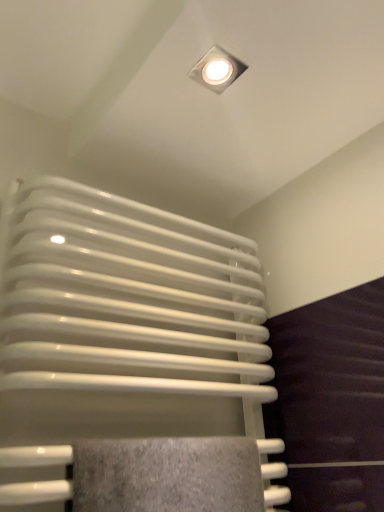
Question: Are white glossy square lamp at upper center and white glossy radiator at center located far from each other?

Choices:
 (A) yes
 (B) no

Answer: (B)

Question: Is white glossy radiator at center at the back of white glossy square lamp at upper center?

Choices:
 (A) yes
 (B) no

Answer: (B)

Question: Is white glossy square lamp at upper center shorter than white glossy radiator at center?

Choices:
 (A) yes
 (B) no

Answer: (A)

Question: Is white glossy square lamp at upper center thinner than white glossy radiator at center?

Choices:
 (A) no
 (B) yes

Answer: (B)

Question: Does white glossy square lamp at upper center have a greater height compared to white glossy radiator at center?

Choices:
 (A) no
 (B) yes

Answer: (A)

Question: Does white glossy square lamp at upper center appear on the left side of white glossy radiator at center?

Choices:
 (A) no
 (B) yes

Answer: (A)

Question: Can you confirm if white glossy radiator at center is positioned to the right of white glossy square lamp at upper center?

Choices:
 (A) yes
 (B) no

Answer: (B)

Question: Does white glossy radiator at center have a smaller size compared to white glossy square lamp at upper center?

Choices:
 (A) no
 (B) yes

Answer: (A)

Question: Is white glossy radiator at center oriented towards white glossy square lamp at upper center?

Choices:
 (A) yes
 (B) no

Answer: (B)

Question: From the image's perspective, does white glossy radiator at center appear higher than white glossy square lamp at upper center?

Choices:
 (A) no
 (B) yes

Answer: (A)

Question: Does white glossy radiator at center come behind white glossy square lamp at upper center?

Choices:
 (A) yes
 (B) no

Answer: (B)

Question: Is white glossy square lamp at upper center inside white glossy radiator at center?

Choices:
 (A) yes
 (B) no

Answer: (B)

Question: From a real-world perspective, is white glossy square lamp at upper center physically located above or below white glossy radiator at center?

Choices:
 (A) above
 (B) below

Answer: (A)